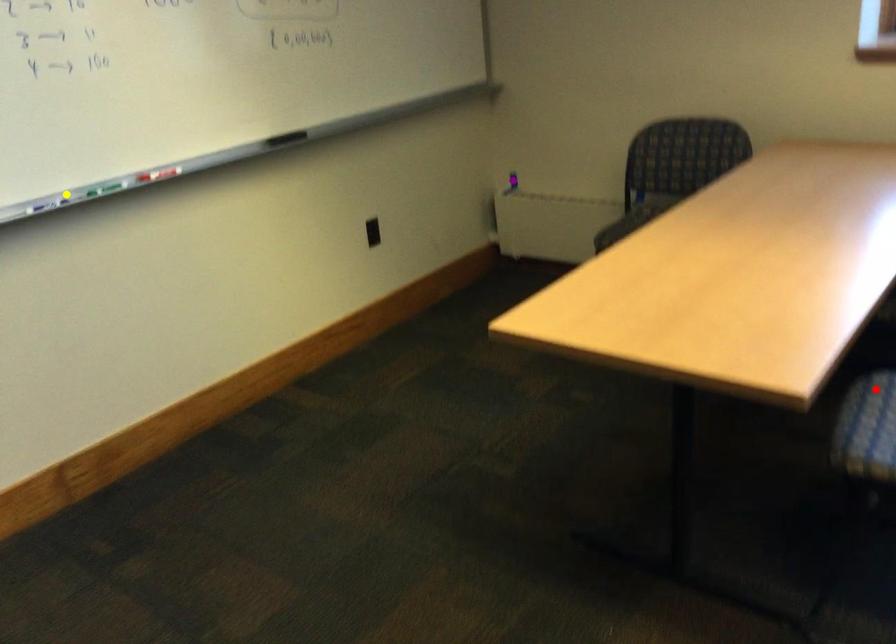
Order these from nearest to farthest:
yellow point
red point
purple point

purple point < yellow point < red point